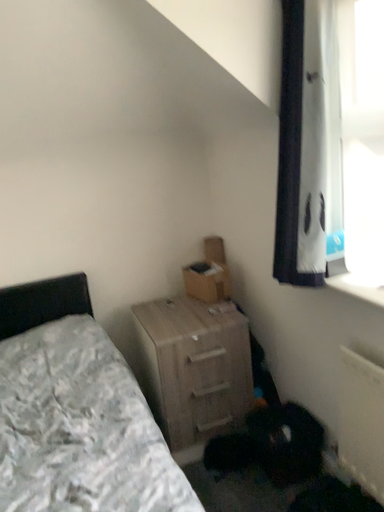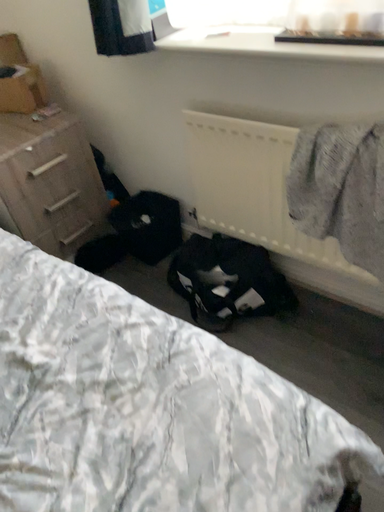
Question: How did the camera likely rotate when shooting the video?

Choices:
 (A) rotated left
 (B) rotated right

Answer: (B)